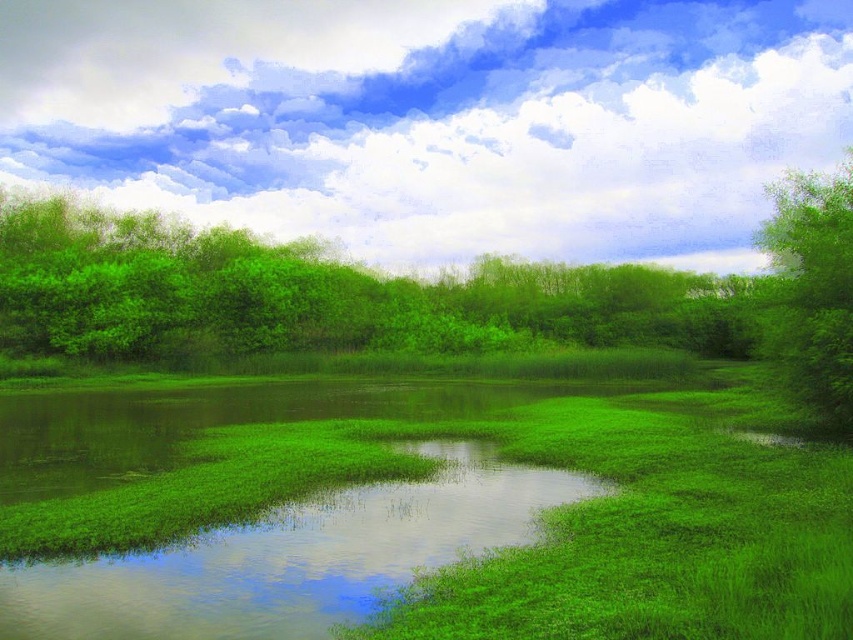
Is green leafy trees at upper center behind green leafy tree at right?

Yes.

Who is lower down, green leafy trees at upper center or green leafy tree at right?

green leafy trees at upper center is below.

Measure the distance between green leafy trees at upper center and camera.

A distance of 49.94 meters exists between green leafy trees at upper center and camera.

This screenshot has width=853, height=640. Find the location of `green leafy trees at upper center`. green leafy trees at upper center is located at coordinates (320, 294).

From the picture: Does green leafy trees at upper center have a greater height compared to green grassy water at center?

Yes, green leafy trees at upper center is taller than green grassy water at center.

From the picture: Who is more forward, (242, 250) or (318, 548)?

Point (318, 548)

Who is more distant from viewer, [35,337] or [340,504]?

Point [35,337]

Locate an element on the screen. green leafy trees at upper center is located at coordinates (320, 294).

Who is positioned more to the left, green grassy water at center or green leafy tree at right?

Positioned to the left is green grassy water at center.

You are a GUI agent. You are given a task and a screenshot of the screen. Output one action in this format:
    pyautogui.click(x=<x>, y=<y>)
    Task: Click on the green grassy water at center
    This screenshot has height=640, width=853.
    Given the screenshot: What is the action you would take?
    pyautogui.click(x=291, y=557)

Find the location of a particular element. The image size is (853, 640). green grassy water at center is located at coordinates (291, 557).